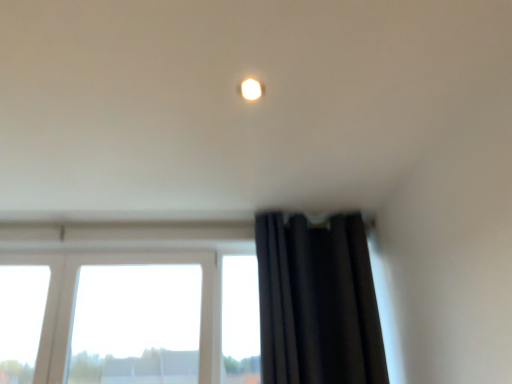
Question: Should I look upward or downward to see black velvet curtain at right?

Choices:
 (A) down
 (B) up

Answer: (A)

Question: Is black velvet curtain at right behind matte white light fixture at upper center?

Choices:
 (A) no
 (B) yes

Answer: (B)

Question: Can you confirm if black velvet curtain at right is bigger than matte white light fixture at upper center?

Choices:
 (A) no
 (B) yes

Answer: (B)

Question: Does black velvet curtain at right have a smaller size compared to matte white light fixture at upper center?

Choices:
 (A) yes
 (B) no

Answer: (B)

Question: Considering the relative sizes of black velvet curtain at right and matte white light fixture at upper center in the image provided, is black velvet curtain at right wider than matte white light fixture at upper center?

Choices:
 (A) yes
 (B) no

Answer: (A)

Question: From the image's perspective, is black velvet curtain at right above matte white light fixture at upper center?

Choices:
 (A) yes
 (B) no

Answer: (B)

Question: Does black velvet curtain at right turn towards matte white light fixture at upper center?

Choices:
 (A) yes
 (B) no

Answer: (A)

Question: Considering the relative sizes of matte white light fixture at upper center and black velvet curtain at right in the image provided, is matte white light fixture at upper center thinner than black velvet curtain at right?

Choices:
 (A) no
 (B) yes

Answer: (B)

Question: Is matte white light fixture at upper center wider than black velvet curtain at right?

Choices:
 (A) no
 (B) yes

Answer: (A)

Question: Could you tell me if matte white light fixture at upper center is facing black velvet curtain at right?

Choices:
 (A) no
 (B) yes

Answer: (A)

Question: Does matte white light fixture at upper center have a smaller size compared to black velvet curtain at right?

Choices:
 (A) yes
 (B) no

Answer: (A)

Question: Can you confirm if matte white light fixture at upper center is positioned to the right of black velvet curtain at right?

Choices:
 (A) no
 (B) yes

Answer: (A)

Question: Does matte white light fixture at upper center have a greater height compared to black velvet curtain at right?

Choices:
 (A) no
 (B) yes

Answer: (A)

Question: Looking at their shapes, would you say matte white light fixture at upper center is wider or thinner than black velvet curtain at right?

Choices:
 (A) wide
 (B) thin

Answer: (B)